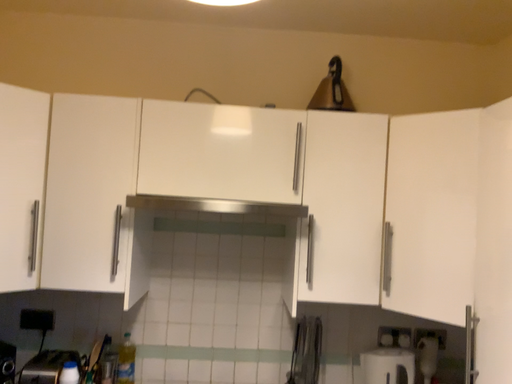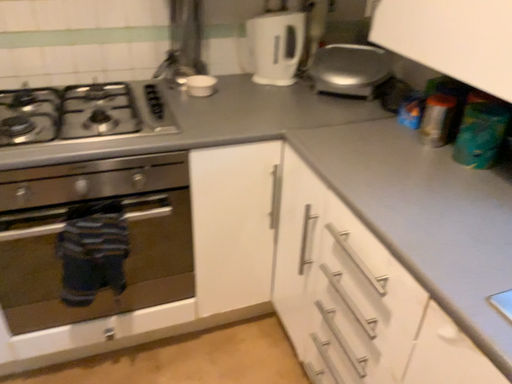
Question: How did the camera likely rotate when shooting the video?

Choices:
 (A) rotated upward
 (B) rotated downward

Answer: (B)